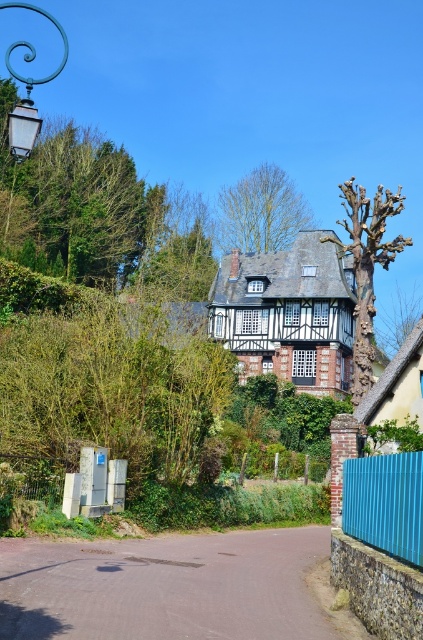
Question: Is bare wood tree at right wider than teal wrought iron lamp post at upper left?

Choices:
 (A) no
 (B) yes

Answer: (A)

Question: Considering the relative positions of green leafy tree at center and teal wrought iron lamp post at upper left in the image provided, where is green leafy tree at center located with respect to teal wrought iron lamp post at upper left?

Choices:
 (A) right
 (B) left

Answer: (A)

Question: Can you confirm if blue corrugated metal fence at lower right is positioned to the left of teal wrought iron lamp post at upper left?

Choices:
 (A) no
 (B) yes

Answer: (A)

Question: Which is nearer to the blue corrugated metal fence at lower right?

Choices:
 (A) bare wood tree at right
 (B) green leafy tree at center

Answer: (A)

Question: Based on their relative distances, which object is nearer to the bare wood tree at right?

Choices:
 (A) teal wrought iron lamp post at upper left
 (B) green leafy tree at center
 (C) blue corrugated metal fence at lower right

Answer: (C)

Question: Which point is closer to the camera?

Choices:
 (A) (24, 108)
 (B) (236, 200)

Answer: (A)